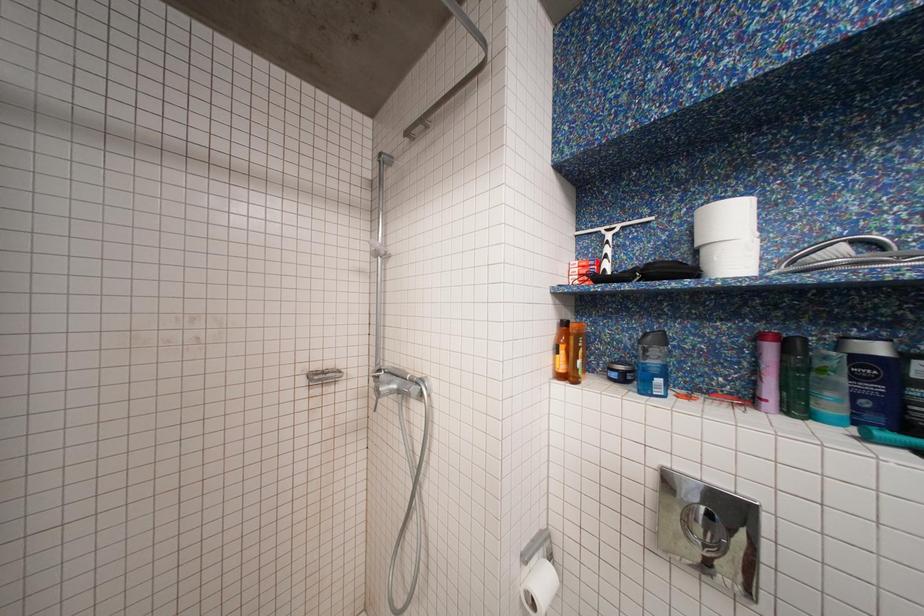
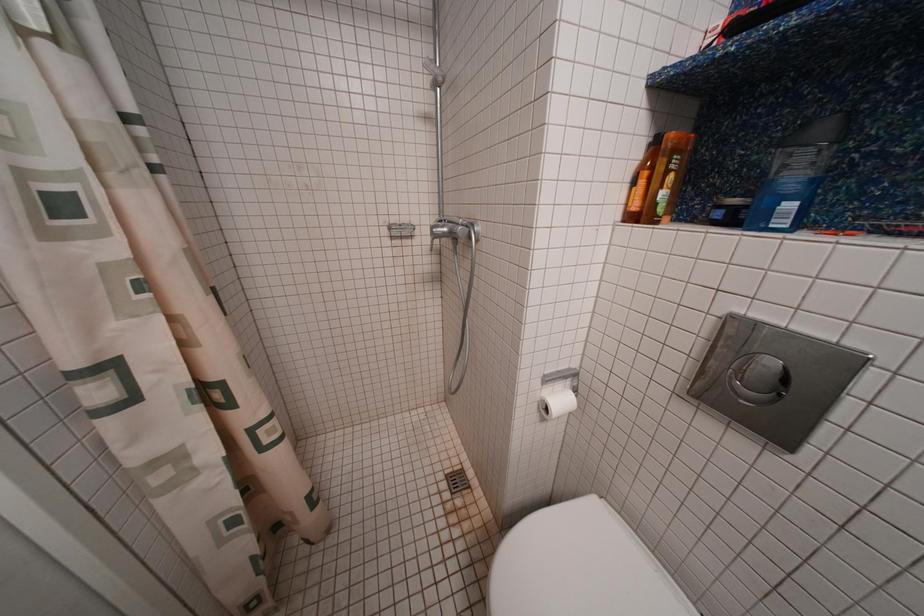
First-person continuous shooting, in which direction is the camera rotating?

The camera rotated toward left-down.